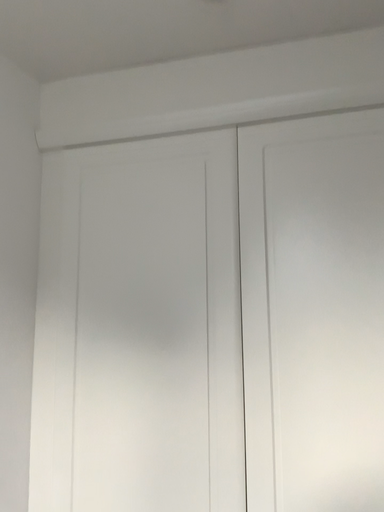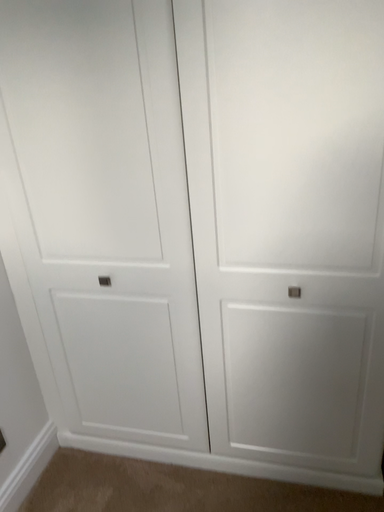
Question: Which way did the camera rotate in the video?

Choices:
 (A) rotated downward
 (B) rotated upward

Answer: (A)